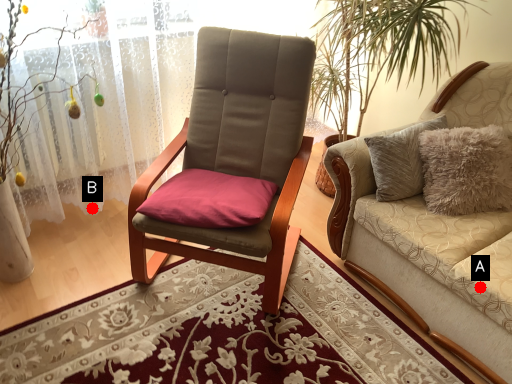
Question: Two points are circled on the image, labeled by A and B beside each circle. Which point appears closest to the camera in this image?

Choices:
 (A) A is closer
 (B) B is closer

Answer: (A)